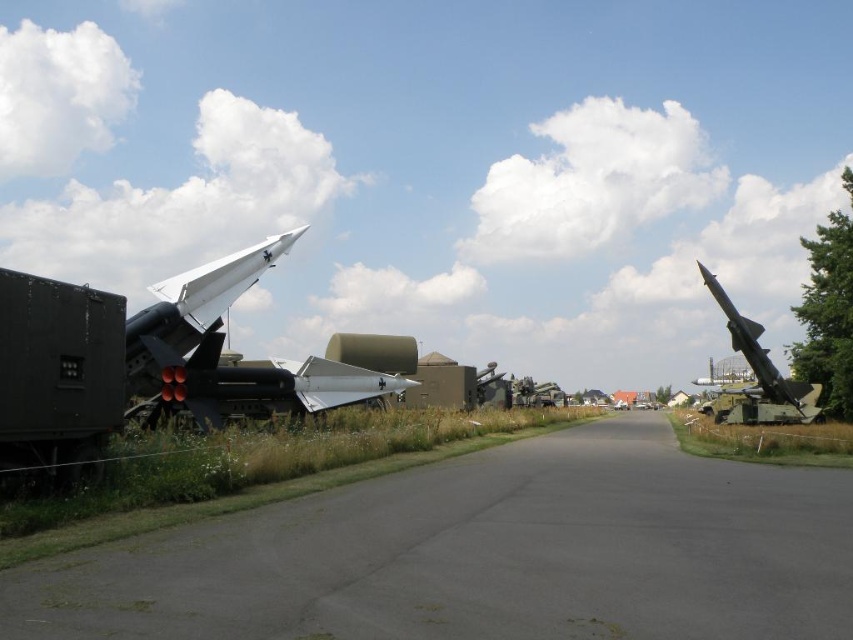
Question: Is white matte missile at left closer to the viewer compared to shiny metallic missile at right?

Choices:
 (A) yes
 (B) no

Answer: (A)

Question: Which of the following is the closest to the observer?

Choices:
 (A) (184, 276)
 (B) (793, 396)

Answer: (A)

Question: Which point is farther to the camera?

Choices:
 (A) white matte missile at left
 (B) shiny metallic missile at right

Answer: (B)

Question: Can you confirm if white matte missile at left is smaller than shiny metallic missile at right?

Choices:
 (A) no
 (B) yes

Answer: (B)

Question: Can you confirm if white matte missile at left is positioned to the right of shiny metallic missile at right?

Choices:
 (A) no
 (B) yes

Answer: (A)